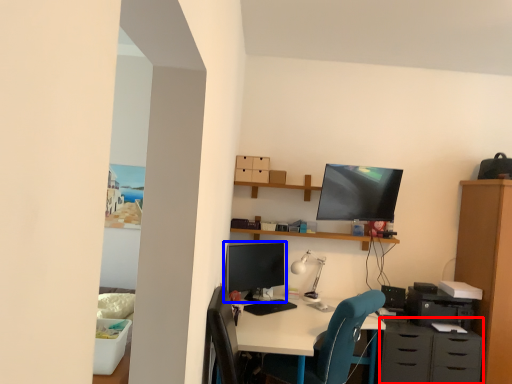
Question: Which of the following is the closest to the observer, dresser (highlighted by a red box) or computer monitor (highlighted by a blue box)?

Choices:
 (A) dresser
 (B) computer monitor

Answer: (A)